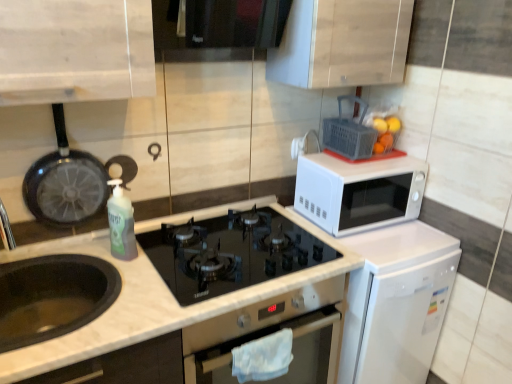
Where is `free region on the left part of translucent plastic basket at upper right`? The width and height of the screenshot is (512, 384). free region on the left part of translucent plastic basket at upper right is located at coordinates (324, 156).